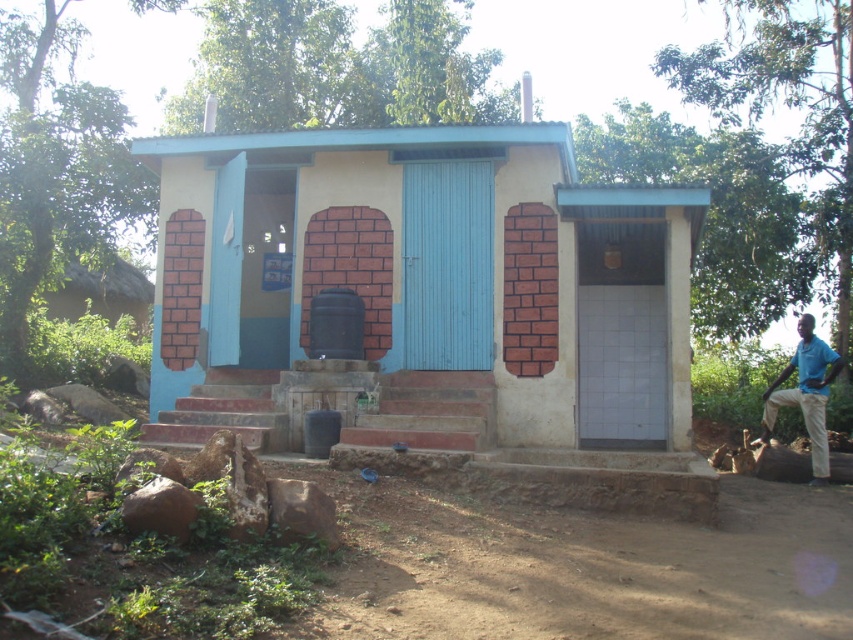
Question: Which object is farther from the camera taking this photo?

Choices:
 (A) blue shirt at right
 (B) matte blue door at center

Answer: (A)

Question: Is matte blue door at center thinner than blue shirt at right?

Choices:
 (A) no
 (B) yes

Answer: (B)

Question: Among these points, which one is nearest to the camera?

Choices:
 (A) [x=666, y=410]
 (B) [x=764, y=420]

Answer: (A)

Question: Does matte blue door at center have a smaller size compared to blue shirt at right?

Choices:
 (A) no
 (B) yes

Answer: (B)

Question: Can you confirm if matte blue door at center is thinner than blue shirt at right?

Choices:
 (A) yes
 (B) no

Answer: (A)